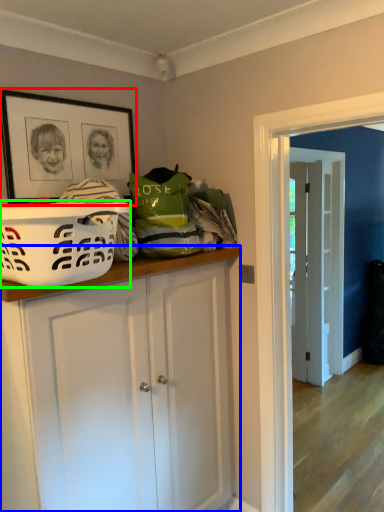
Question: Which object is the closest to the picture frame (highlighted by a red box)? Choose among these: cabinetry (highlighted by a blue box) or basket (highlighted by a green box).

Choices:
 (A) cabinetry
 (B) basket

Answer: (B)